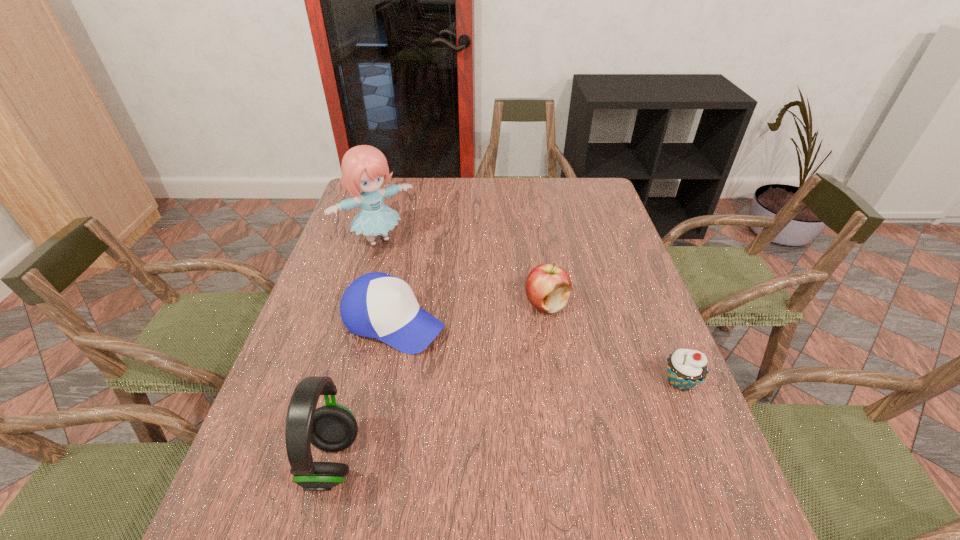
Identify the location of vacant space at the near right corner of the desktop. The height and width of the screenshot is (540, 960). (700, 483).

Identify the location of empty location between the fourth farthest object and the baseball cap. This screenshot has height=540, width=960. (537, 352).

The image size is (960, 540). What are the coordinates of `vacant region between the headset and the rightmost object` in the screenshot? It's located at (506, 422).

Identify the location of vacant point located between the tallest object and the nearest object. The width and height of the screenshot is (960, 540). (354, 350).

Find the location of a particular element. This screenshot has width=960, height=540. vacant space that's between the apple and the nearest object is located at coordinates (439, 383).

Where is `free spot between the farthest object and the nearest object`? The image size is (960, 540). free spot between the farthest object and the nearest object is located at coordinates (354, 350).

I want to click on free space between the farthest object and the rightmost object, so click(x=529, y=310).

Locate an element on the screen. vacant area that lies between the headset and the fourth farthest object is located at coordinates (506, 422).

This screenshot has width=960, height=540. Identify the location of vacant point located between the doll and the nearest object. (354, 350).

I want to click on vacant area between the baseball cap and the apple, so click(x=470, y=313).